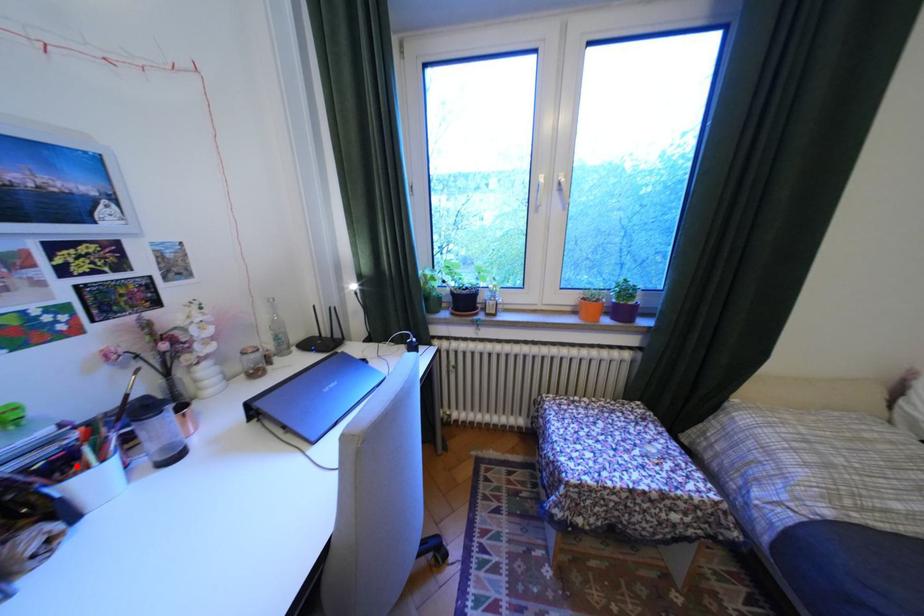
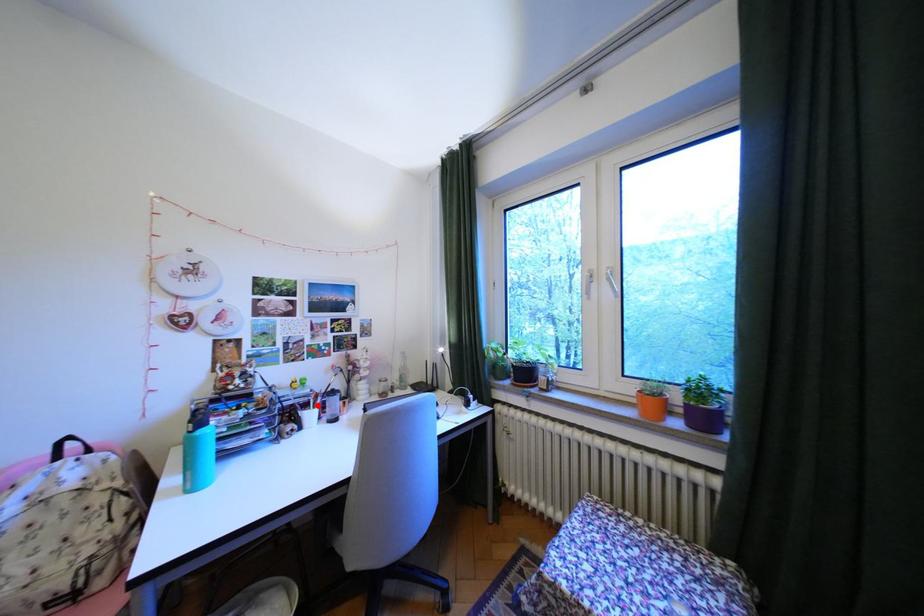
I am providing you with two images of the same scene from different viewpoints. A red point is marked on the first image and another point is marked on the second image. Do the highlighted points in image1 and image2 indicate the same real-world spot?

Yes